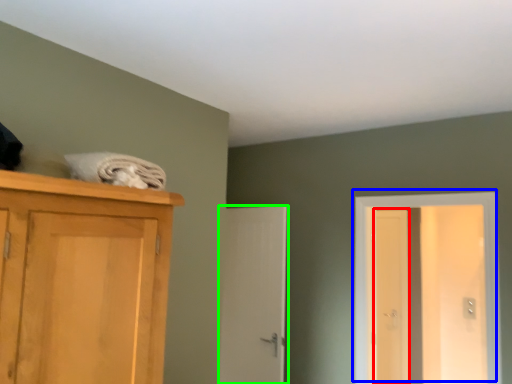
Question: Which object is positioned farthest from screen door (highlighted by a red box)? Select from door (highlighted by a blue box) and door (highlighted by a green box).

Choices:
 (A) door
 (B) door

Answer: (B)